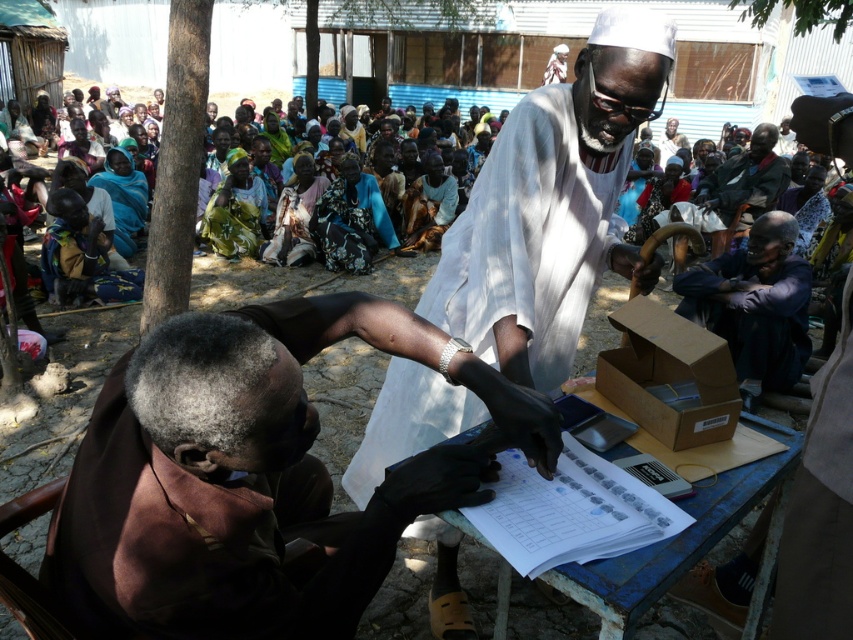
Does white cloth at center appear on the left side of floral print fabric at center?

In fact, white cloth at center is to the right of floral print fabric at center.

Can you confirm if white cloth at center is smaller than floral print fabric at center?

Incorrect, white cloth at center is not smaller in size than floral print fabric at center.

I want to click on white cloth at center, so click(x=552, y=205).

Between point (485, 365) and point (334, 232), which one is positioned in front?

Point (485, 365) is more forward.

Is brown leather glove at lower left to the left of floral print fabric at center from the viewer's perspective?

No, brown leather glove at lower left is not to the left of floral print fabric at center.

Does point (439, 451) come in front of point (345, 189)?

Yes, point (439, 451) is in front of point (345, 189).

Where is `brown leather glove at lower left`? This screenshot has height=640, width=853. brown leather glove at lower left is located at coordinates (242, 500).

Who is taller, brown leather glove at lower left or purple fabric shirt at lower right?

purple fabric shirt at lower right is taller.

Image resolution: width=853 pixels, height=640 pixels. Find the location of `brown leather glove at lower left`. brown leather glove at lower left is located at coordinates (242, 500).

What are the coordinates of `brown leather glove at lower left` in the screenshot? It's located at (242, 500).